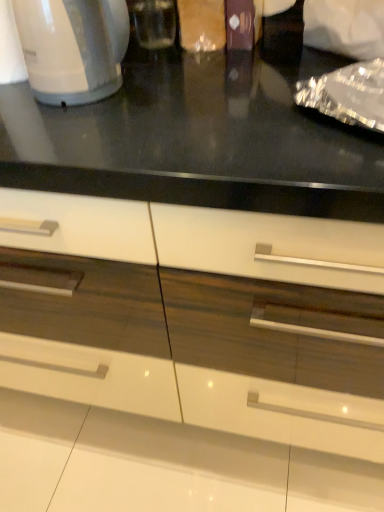
Question: From a real-world perspective, relative to white glossy electric kettle at left, is white glossy cabinet at center vertically above or below?

Choices:
 (A) below
 (B) above

Answer: (A)

Question: Which is correct: white glossy cabinet at center is inside white glossy electric kettle at left, or outside of it?

Choices:
 (A) outside
 (B) inside

Answer: (A)

Question: Is point (190, 212) positioned closer to the camera than point (34, 44)?

Choices:
 (A) closer
 (B) farther

Answer: (A)

Question: Considering the positions of white glossy electric kettle at left and white glossy cabinet at center in the image, is white glossy electric kettle at left taller or shorter than white glossy cabinet at center?

Choices:
 (A) short
 (B) tall

Answer: (A)

Question: Is point (94, 9) positioned closer to the camera than point (114, 484)?

Choices:
 (A) closer
 (B) farther

Answer: (A)

Question: Considering the relative positions of white glossy electric kettle at left and white glossy cabinet at center in the image provided, is white glossy electric kettle at left to the left or to the right of white glossy cabinet at center?

Choices:
 (A) left
 (B) right

Answer: (A)

Question: From a real-world perspective, is white glossy electric kettle at left above or below white glossy cabinet at center?

Choices:
 (A) below
 (B) above

Answer: (B)